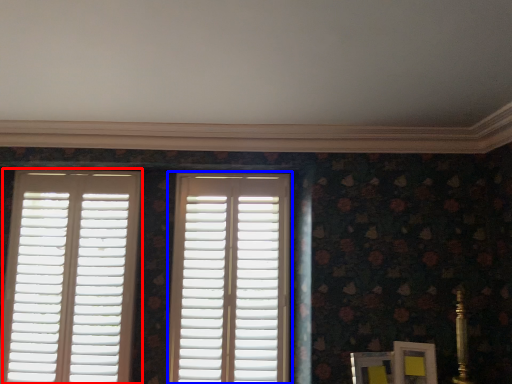
Question: Among these objects, which one is nearest to the camera, window (highlighted by a red box) or window (highlighted by a blue box)?

Choices:
 (A) window
 (B) window

Answer: (B)